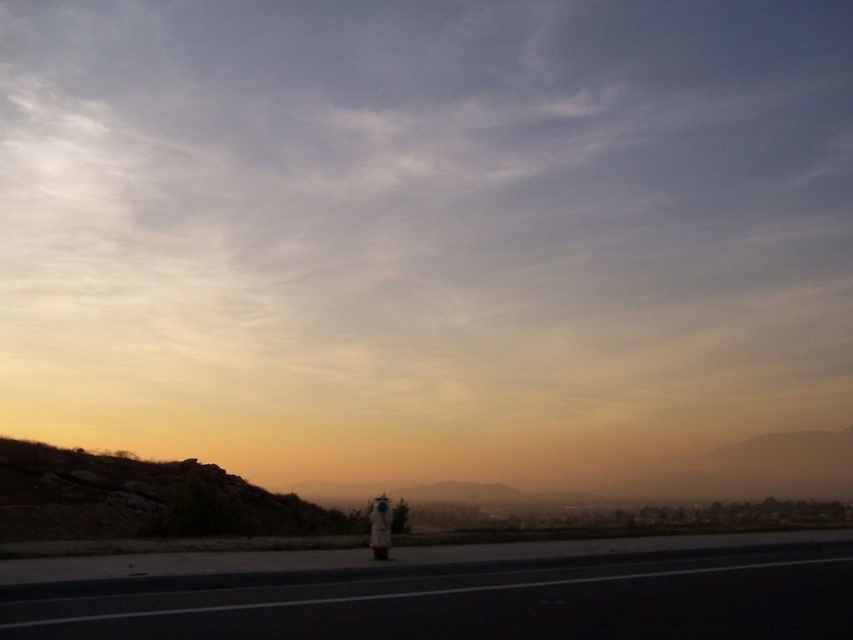
Which is behind, point (54, 621) or point (380, 541)?

The point (380, 541) is behind.

This screenshot has height=640, width=853. I want to click on black asphalt highway at lower center, so (448, 592).

Which is in front, point (152, 474) or point (386, 557)?

Point (386, 557)

Between dull brown rock at lower left and white fabric person at lower center, which one is positioned higher?

white fabric person at lower center is higher up.

Between point (25, 448) and point (370, 541), which one is positioned behind?

Positioned behind is point (25, 448).

What are the coordinates of `dull brown rock at lower left` in the screenshot? It's located at (138, 499).

From the picture: Is black asphalt highway at lower center further to the viewer compared to dull brown rock at lower left?

No, black asphalt highway at lower center is in front of dull brown rock at lower left.

Is point (527, 612) positioned before point (16, 481)?

That is True.

The width and height of the screenshot is (853, 640). Find the location of `black asphalt highway at lower center`. black asphalt highway at lower center is located at coordinates (448, 592).